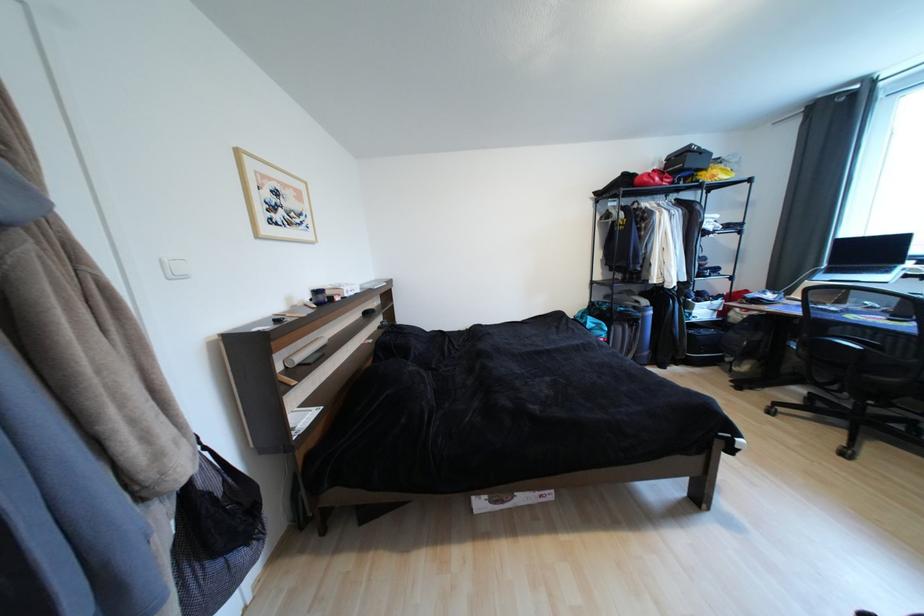
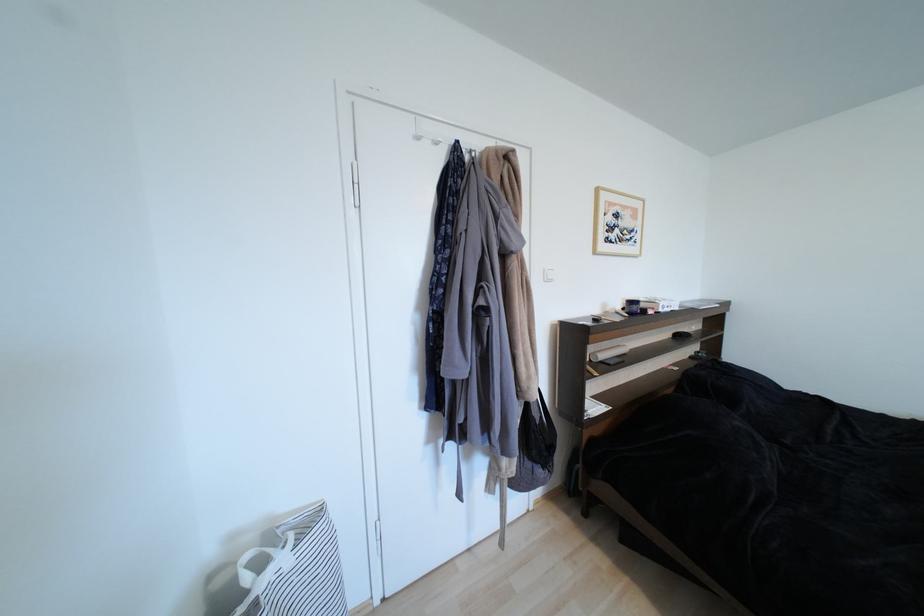
The point at (323,294) is marked in the first image. Where is the corresponding point in the second image?

(638, 304)